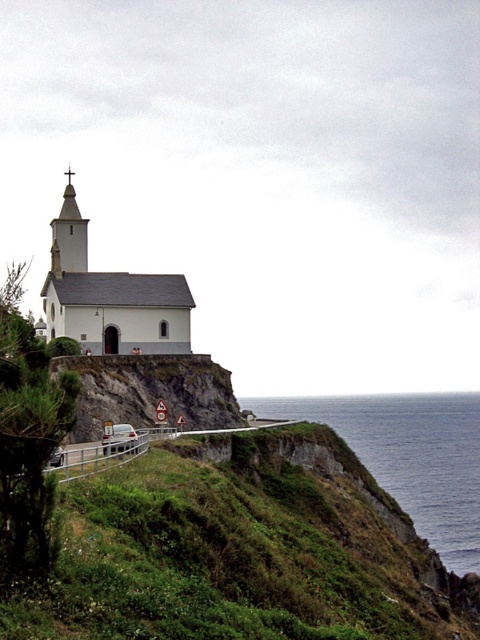
You are standing at the cliff edge near the church and want to take a photo. You notice two points marked in the scene. Which of the two points, point (x=54, y=298) or point (x=74, y=221), is closer to your current position?

Point (x=54, y=298) is closer to the camera than point (x=74, y=221), so it is closer to your current position.

You are a photographer planning to capture the white matte church at center and the wooden spire at upper left in a single shot. Based on their heights, which object should you position closer to the camera to ensure both are fully visible in the frame?

The white matte church at center is taller than the wooden spire at upper left. To ensure both are fully visible, position the camera closer to the wooden spire at upper left so that its apparent size matches the church, preventing the spire from appearing too small in the frame.